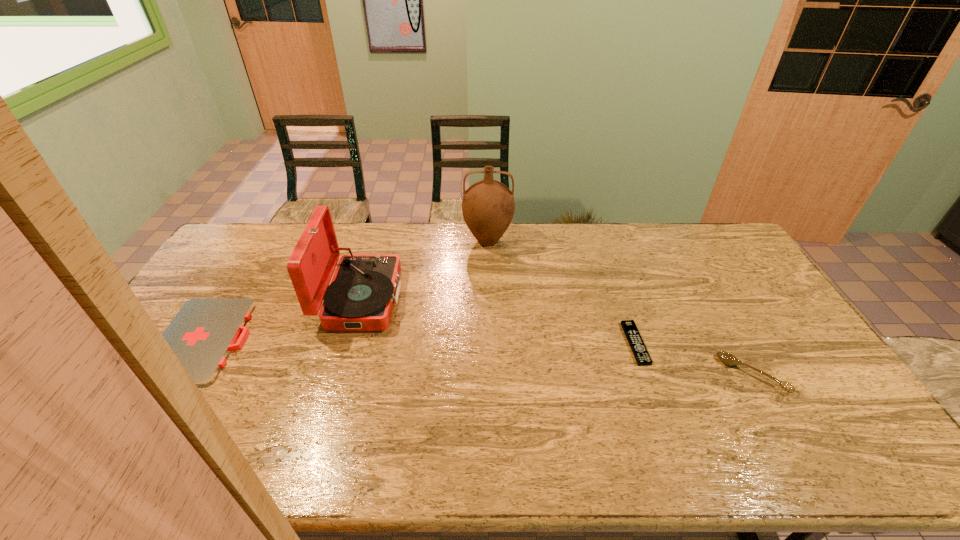
This screenshot has width=960, height=540. I want to click on pitcher, so click(x=488, y=206).

The height and width of the screenshot is (540, 960). Find the location of `the third object from left to right`. the third object from left to right is located at coordinates (488, 206).

Locate an element on the screen. the fourth object from right to left is located at coordinates (364, 288).

This screenshot has height=540, width=960. I want to click on the third tallest object, so click(727, 358).

Find the location of a particular element. ladle is located at coordinates (727, 358).

Identify the location of the first-aid kit. (203, 333).

Identify the location of the leftmost object. This screenshot has height=540, width=960. (203, 333).

Locate an element on the screen. Image resolution: width=960 pixels, height=540 pixels. remote control is located at coordinates (640, 352).

Image resolution: width=960 pixels, height=540 pixels. Find the location of `the shortest object`. the shortest object is located at coordinates (640, 352).

Image resolution: width=960 pixels, height=540 pixels. I want to click on free region located on the front of the farthest object, so click(x=490, y=339).